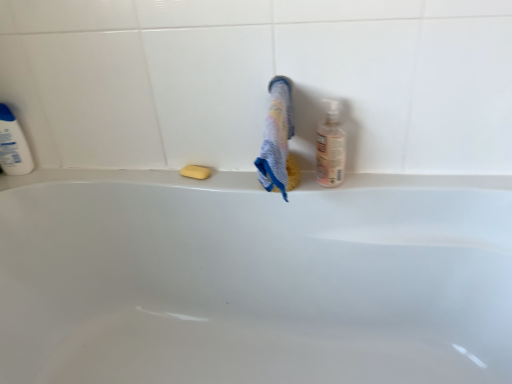
Question: Can you confirm if translucent plastic bottle at right, the 2th cleaning product in the left-to-right sequence, is wider than white plastic bottle at left, the 2th cleaning product in the right-to-left sequence?

Choices:
 (A) no
 (B) yes

Answer: (B)

Question: Is translucent plastic bottle at right, arranged as the 2th cleaning product when viewed from the back, behind white plastic bottle at left, the 2th cleaning product in the right-to-left sequence?

Choices:
 (A) yes
 (B) no

Answer: (B)

Question: Considering the relative sizes of translucent plastic bottle at right, the 1th cleaning product viewed from the right, and white plastic bottle at left, the 2th cleaning product in the front-to-back sequence, in the image provided, is translucent plastic bottle at right, the 1th cleaning product viewed from the right, taller than white plastic bottle at left, the 2th cleaning product in the front-to-back sequence,?

Choices:
 (A) no
 (B) yes

Answer: (B)

Question: Could white plastic bottle at left, the first cleaning product viewed from the left, be considered to be inside translucent plastic bottle at right, arranged as the 2th cleaning product when viewed from the back?

Choices:
 (A) yes
 (B) no

Answer: (B)

Question: Is translucent plastic bottle at right, the 1th cleaning product viewed from the right, at the left side of white plastic bottle at left, the 2th cleaning product in the front-to-back sequence?

Choices:
 (A) no
 (B) yes

Answer: (A)

Question: Relative to translucent plastic bottle at right, which is counted as the first cleaning product, starting from the front, is white glossy bathtub at center in front or behind?

Choices:
 (A) front
 (B) behind

Answer: (A)

Question: From the image's perspective, is white glossy bathtub at center positioned above or below translucent plastic bottle at right, which is counted as the first cleaning product, starting from the front?

Choices:
 (A) above
 (B) below

Answer: (B)

Question: Does point (177, 319) appear closer or farther from the camera than point (331, 107)?

Choices:
 (A) closer
 (B) farther

Answer: (B)

Question: Based on their positions, is white glossy bathtub at center located to the left or right of translucent plastic bottle at right, which is counted as the first cleaning product, starting from the front?

Choices:
 (A) right
 (B) left

Answer: (B)

Question: From their relative heights in the image, would you say multicolored textured towel at center is taller or shorter than white plastic bottle at left, the first cleaning product positioned from the back?

Choices:
 (A) short
 (B) tall

Answer: (A)

Question: Considering their positions, is multicolored textured towel at center located in front of or behind white plastic bottle at left, the first cleaning product viewed from the left?

Choices:
 (A) front
 (B) behind

Answer: (A)

Question: From a real-world perspective, is multicolored textured towel at center above or below white plastic bottle at left, the first cleaning product positioned from the back?

Choices:
 (A) above
 (B) below

Answer: (A)

Question: From the image's perspective, is multicolored textured towel at center above or below white plastic bottle at left, the first cleaning product positioned from the back?

Choices:
 (A) below
 (B) above

Answer: (A)

Question: Is translucent plastic bottle at right, arranged as the 2th cleaning product when viewed from the back, to the left or to the right of white plastic bottle at left, the 2th cleaning product in the front-to-back sequence, in the image?

Choices:
 (A) left
 (B) right

Answer: (B)

Question: Is translucent plastic bottle at right, the 1th cleaning product viewed from the right, bigger or smaller than white plastic bottle at left, the 2th cleaning product in the right-to-left sequence?

Choices:
 (A) small
 (B) big

Answer: (A)